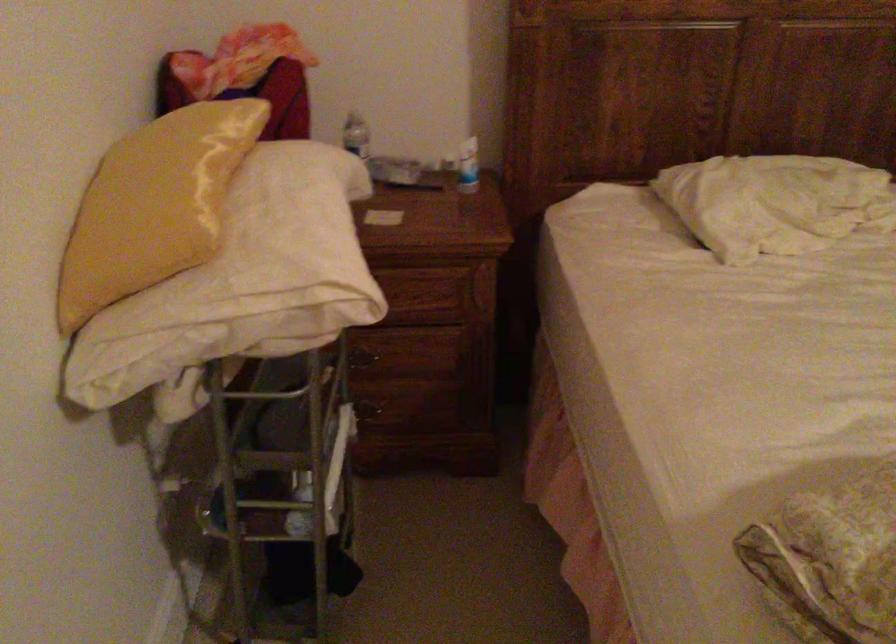
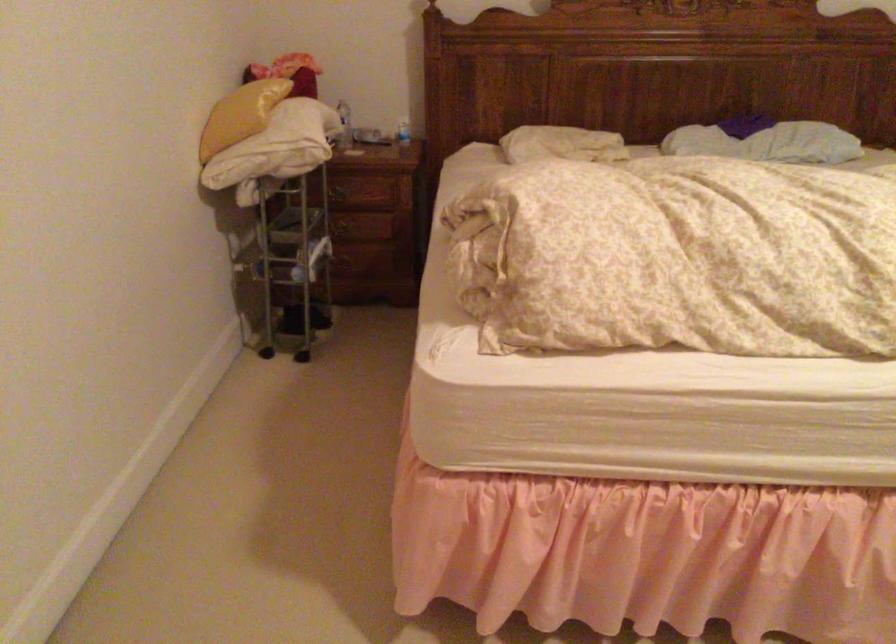
Locate, in the second image, the point that corresponds to the point at 357,366 in the first image.

(342, 230)